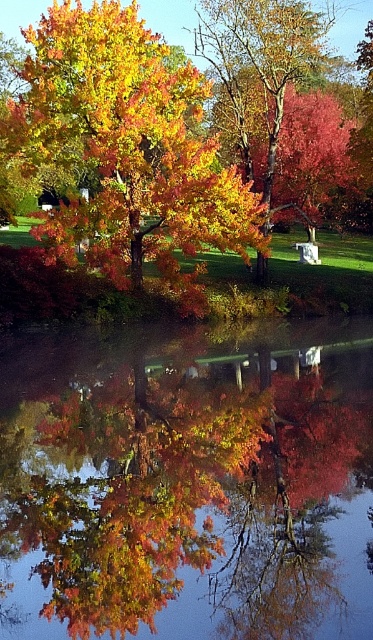
You are standing in the autumn scene and want to pick up the shiny golden leaves at center. Which direction should you move relative to the glossy reflective water at center?

The glossy reflective water at center is to the right of the shiny golden leaves at center, so you should move to the left relative to the glossy reflective water at center to reach the shiny golden leaves at center.